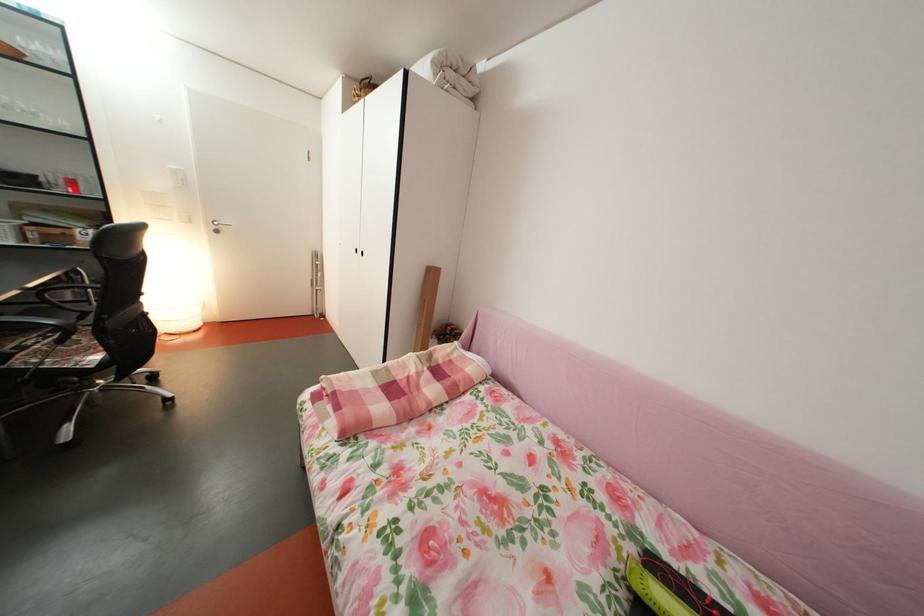
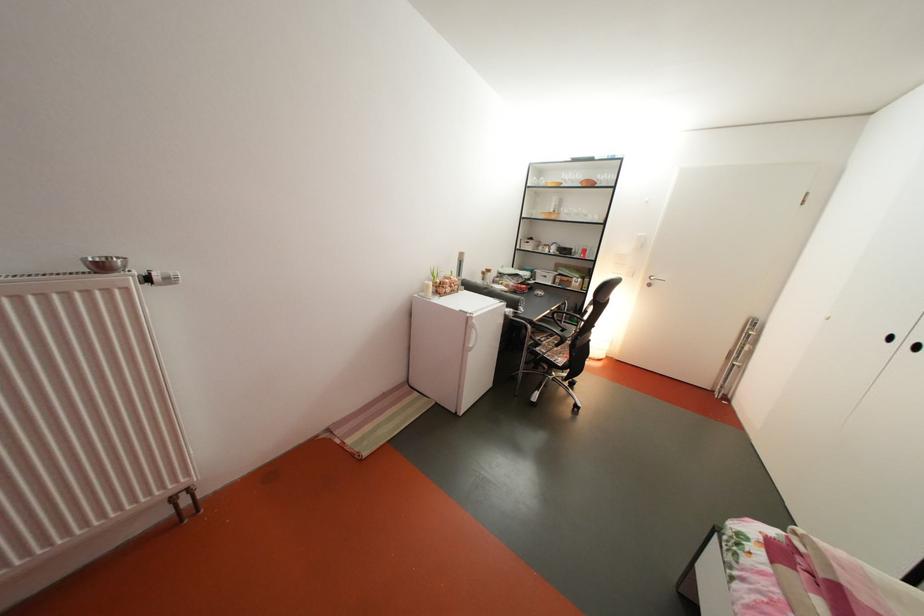
Question: I am providing you with two images of the same scene from different viewpoints. A red point is marked on the first image. At the location where the point appears in image 1, is it still visible in image 2?

Choices:
 (A) Yes
 (B) No

Answer: (A)